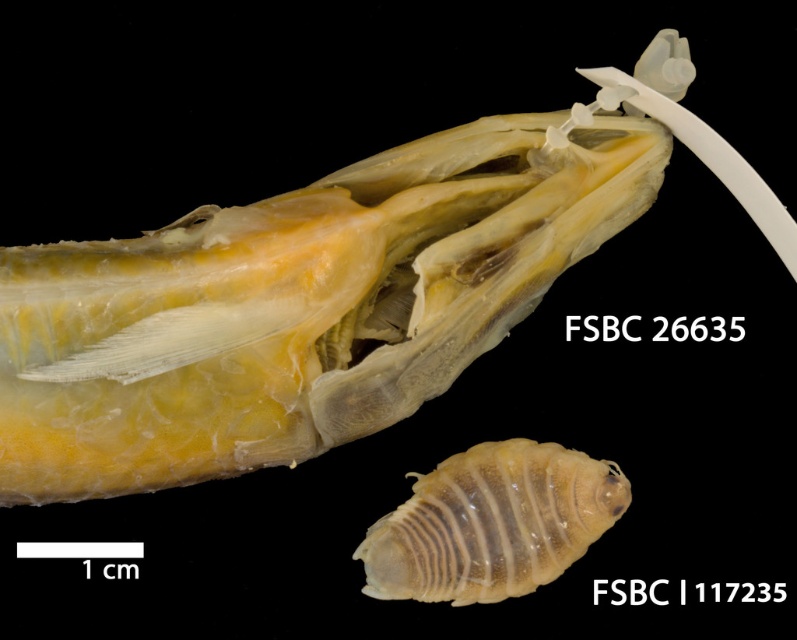
Question: Can you confirm if translucent yellowish flesh at center is positioned below translucent yellowish-white at upper right?

Choices:
 (A) no
 (B) yes

Answer: (A)

Question: Observing the image, what is the correct spatial positioning of translucent yellowish flesh at center in reference to translucent yellowish-white at upper right?

Choices:
 (A) right
 (B) left

Answer: (B)

Question: Which of the following is the farthest from the observer?

Choices:
 (A) (370, 557)
 (B) (560, 186)

Answer: (B)

Question: Does translucent yellowish flesh at center have a lesser width compared to translucent yellowish-white at upper right?

Choices:
 (A) yes
 (B) no

Answer: (B)